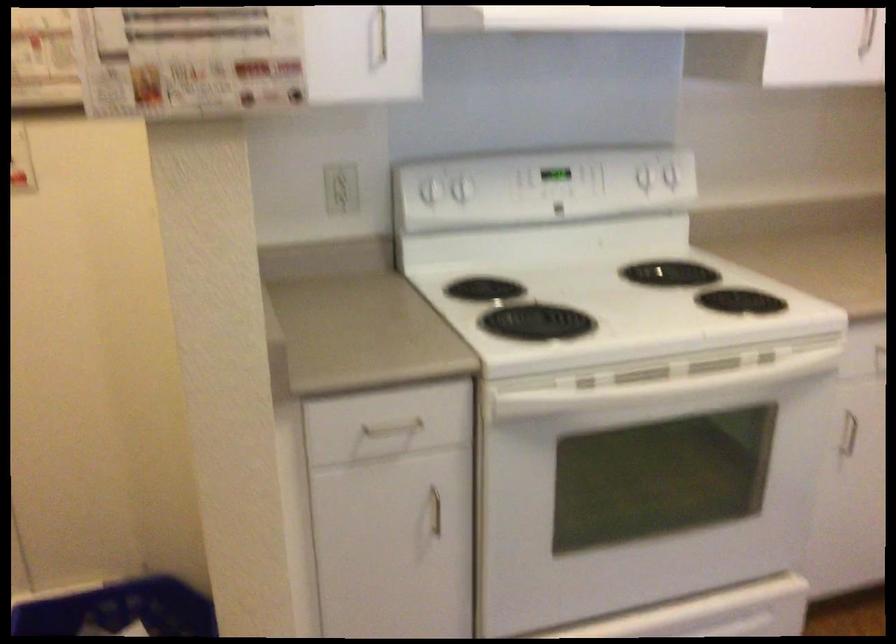
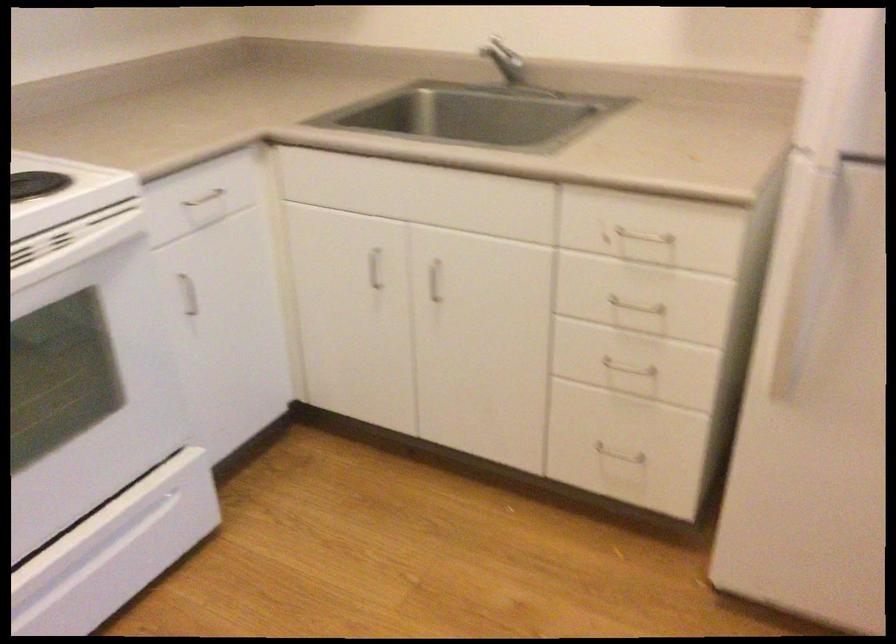
Question: The camera is either moving clockwise (left) or counter-clockwise (right) around the object. The first image is from the beginning of the video and the second image is from the end. Is the camera moving left or right when shooting the video?

Choices:
 (A) Left
 (B) Right

Answer: (A)